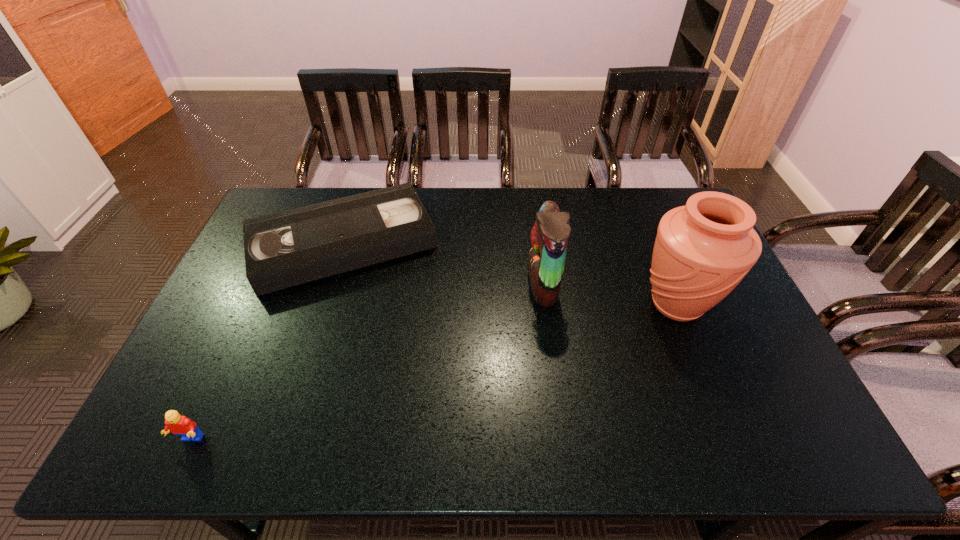
You are a GUI agent. You are given a task and a screenshot of the screen. Output one action in this format:
    pyautogui.click(x=<x>, y=<y>)
    Task: Click on the vacant space in between the second object from right to left and the rightmost object
    The width and height of the screenshot is (960, 540).
    Given the screenshot: What is the action you would take?
    pyautogui.click(x=610, y=294)

Where is `empty location between the nearest object and the tallest object`? The image size is (960, 540). empty location between the nearest object and the tallest object is located at coordinates (433, 372).

You are a GUI agent. You are given a task and a screenshot of the screen. Output one action in this format:
    pyautogui.click(x=<x>, y=<y>)
    Task: Click on the free space between the shortest object and the third tallest object
    Image resolution: width=960 pixels, height=540 pixels.
    Given the screenshot: What is the action you would take?
    pyautogui.click(x=267, y=341)

Locate which object ranks second in proximity to the Lego. Please provide its 2D coordinates. Your answer should be formatted as a tuple, i.e. [(x, y)], where the tuple contains the x and y coordinates of a point satisfying the conditions above.

[(549, 237)]

Image resolution: width=960 pixels, height=540 pixels. Identify the location of object that is the closest to the videotape. (549, 237).

The image size is (960, 540). Find the location of `free space that satisfies the following two spatial constraints: 1. at the face of the parrot; 2. on the right side of the vase`. free space that satisfies the following two spatial constraints: 1. at the face of the parrot; 2. on the right side of the vase is located at coordinates (545, 304).

This screenshot has height=540, width=960. I want to click on free space that satisfies the following two spatial constraints: 1. at the face of the second object from right to left; 2. on the front-facing side of the second shortest object, so click(564, 440).

The height and width of the screenshot is (540, 960). I want to click on vacant region that satisfies the following two spatial constraints: 1. at the face of the parrot; 2. on the front-facing side of the nearest object, so click(x=564, y=440).

Image resolution: width=960 pixels, height=540 pixels. I want to click on vacant position in the image that satisfies the following two spatial constraints: 1. at the face of the second object from right to left; 2. on the left side of the tallest object, so click(x=545, y=304).